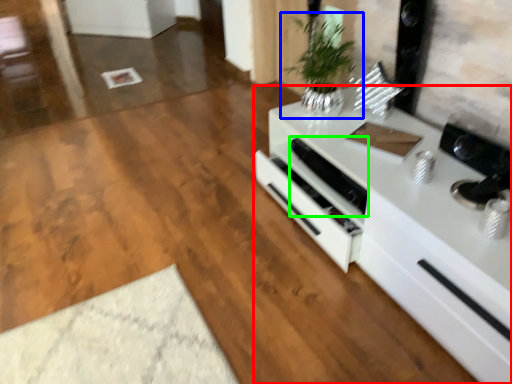
Question: Which object is positioned closest to countertop (highlighted by a red box)? Select from houseplant (highlighted by a blue box) and appliance (highlighted by a green box).

Choices:
 (A) houseplant
 (B) appliance

Answer: (B)